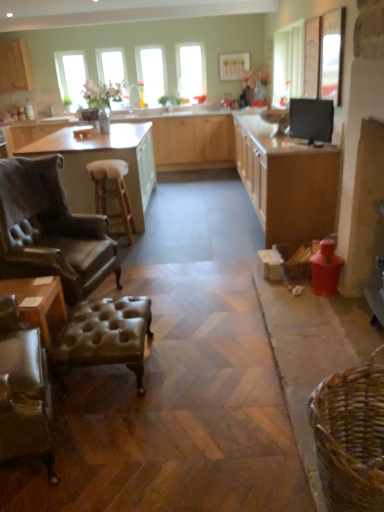
The image size is (384, 512). What are the coordinates of `empty space that is ontop of leather tufted stool at lower left (from a real-world perspective)` in the screenshot? It's located at (114, 318).